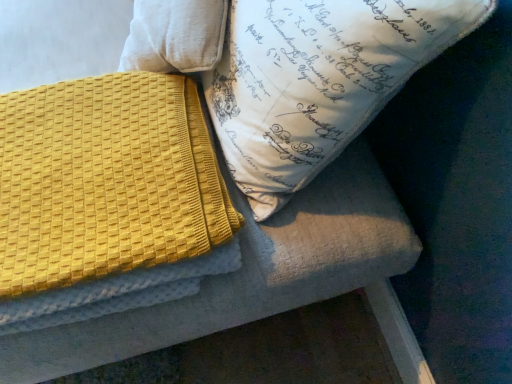
Identify the location of blank space situated above yellow textured blanket at upper left (from a real-world perspective). (117, 136).